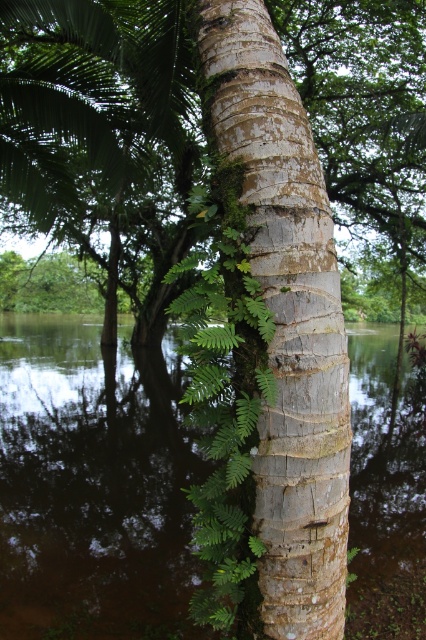
In the scene shown: Who is higher up, green textured bark at center or brown reflective water at center?

green textured bark at center is above.

Is green textured bark at center behind brown reflective water at center?

No, green textured bark at center is in front of brown reflective water at center.

Who is more forward, (31,140) or (26,529)?

Point (26,529) is more forward.

Locate an element on the screen. green textured bark at center is located at coordinates (103, 132).

Between green textured bark at center and smooth bark tree trunk at center, which one is positioned lower?

smooth bark tree trunk at center is below.

Is green textured bark at center positioned behind smooth bark tree trunk at center?

That is True.

Does point (368, 52) come farther from viewer compared to point (330, 406)?

Yes, point (368, 52) is farther from viewer.

I want to click on green textured bark at center, so click(103, 132).

Can you confirm if smooth bark tree trunk at center is thinner than green leafy fern at center?

In fact, smooth bark tree trunk at center might be wider than green leafy fern at center.

Can you confirm if smooth bark tree trunk at center is positioned to the right of green leafy fern at center?

Yes, smooth bark tree trunk at center is to the right of green leafy fern at center.

This screenshot has height=640, width=426. What are the coordinates of `smooth bark tree trunk at center` in the screenshot? It's located at (287, 323).